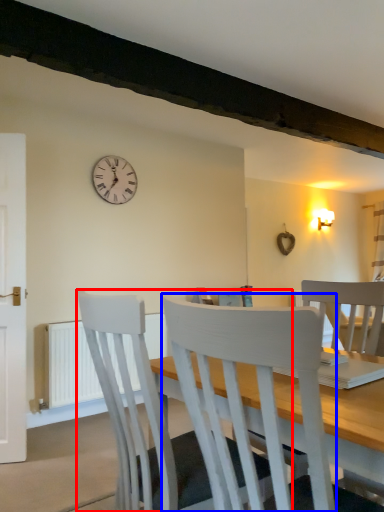
Question: Among these objects, which one is farthest to the camera, chair (highlighted by a red box) or chair (highlighted by a blue box)?

Choices:
 (A) chair
 (B) chair

Answer: (A)